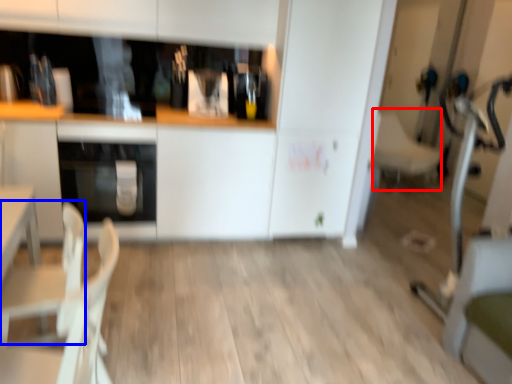
Question: Which object is further to the camera taking this photo, armchair (highlighted by a red box) or armchair (highlighted by a blue box)?

Choices:
 (A) armchair
 (B) armchair

Answer: (A)